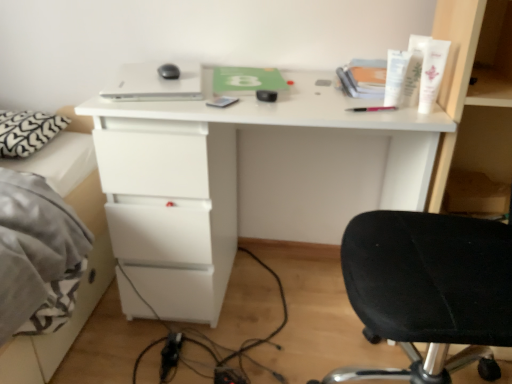
This screenshot has height=384, width=512. What are the coordinates of `free space that is to the left of white plastic tube at upper right, which is counted as the 1th toiletry, starting from the right` in the screenshot? It's located at (364, 109).